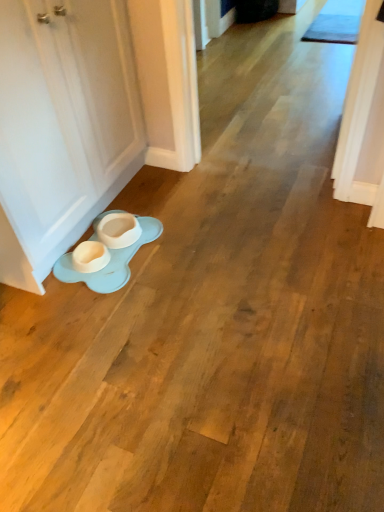
Question: From the image's perspective, is white matte door at lower left above or below light blue rubber saucer at lower left?

Choices:
 (A) below
 (B) above

Answer: (B)

Question: Based on their sizes in the image, would you say white matte door at lower left is bigger or smaller than light blue rubber saucer at lower left?

Choices:
 (A) big
 (B) small

Answer: (A)

Question: Would you say white matte door at lower left is to the left or to the right of light blue rubber saucer at lower left in the picture?

Choices:
 (A) right
 (B) left

Answer: (B)

Question: From the image's perspective, is light blue rubber saucer at lower left positioned above or below white matte door at lower left?

Choices:
 (A) above
 (B) below

Answer: (B)

Question: Is light blue rubber saucer at lower left wider or thinner than white matte door at lower left?

Choices:
 (A) thin
 (B) wide

Answer: (B)

Question: Considering the positions of point (150, 232) and point (44, 29), is point (150, 232) closer or farther from the camera than point (44, 29)?

Choices:
 (A) farther
 (B) closer

Answer: (A)

Question: Considering their positions, is light blue rubber saucer at lower left located in front of or behind white matte door at lower left?

Choices:
 (A) front
 (B) behind

Answer: (B)